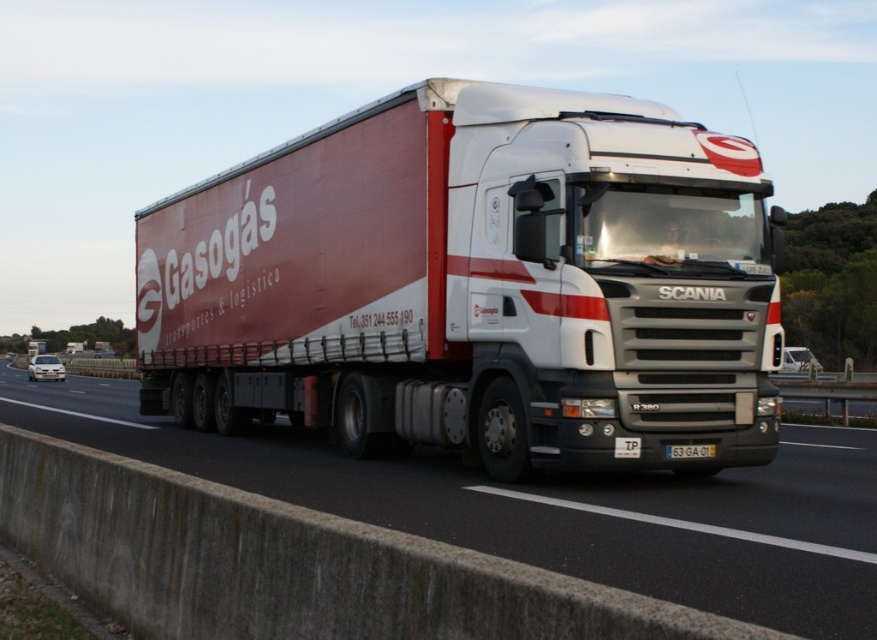
Question: Can you confirm if matte white trailer truck at center is positioned below white plastic license plate at center?

Choices:
 (A) yes
 (B) no

Answer: (B)

Question: Is matte white trailer truck at center to the left of yellow plastic license plate at center from the viewer's perspective?

Choices:
 (A) yes
 (B) no

Answer: (A)

Question: Which object is positioned closest to the yellow plastic license plate at center?

Choices:
 (A) white plastic license plate at center
 (B) white glossy truck at center
 (C) matte white trailer truck at center

Answer: (A)

Question: Which of the following is the farthest from the observer?

Choices:
 (A) matte white trailer truck at center
 (B) white plastic license plate at center

Answer: (B)

Question: Which object is positioned farthest from the white plastic license plate at center?

Choices:
 (A) white glossy truck at center
 (B) yellow plastic license plate at center

Answer: (A)

Question: Considering the relative positions of matte white trailer truck at center and white glossy truck at center in the image provided, where is matte white trailer truck at center located with respect to white glossy truck at center?

Choices:
 (A) left
 (B) right

Answer: (B)